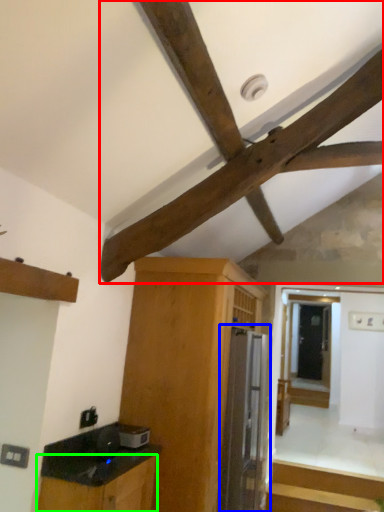
Question: Considering the real-world distances, which object is closest to exhaust hood (highlighted by a red box)? appliance (highlighted by a blue box) or cabinetry (highlighted by a green box).

Choices:
 (A) appliance
 (B) cabinetry

Answer: (B)